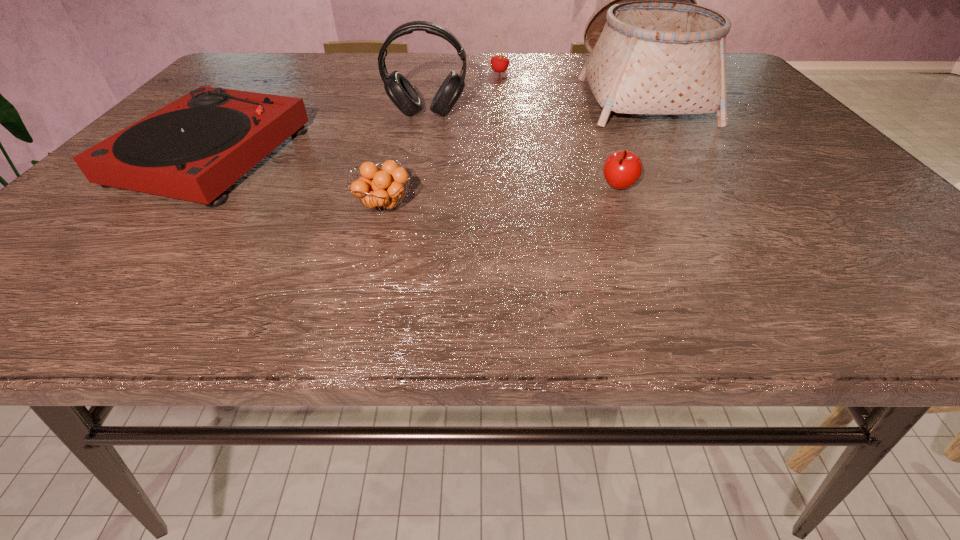
The image size is (960, 540). What are the coordinates of `vacant space located on the earcups of the fifth shortest object` in the screenshot? It's located at (408, 214).

Locate an element on the screen. vacant space positioned 0.260m on the right of the farther cherry is located at coordinates (600, 72).

Find the location of `vacant region located on the front of the record player`. vacant region located on the front of the record player is located at coordinates (125, 261).

The height and width of the screenshot is (540, 960). In order to click on vacant area situated on the back of the right cherry in this screenshot , I will do click(x=596, y=131).

Locate an element on the screen. vacant position located 0.340m on the back of the orange fruit is located at coordinates (409, 110).

The width and height of the screenshot is (960, 540). What are the coordinates of `basket at the far edge` in the screenshot? It's located at (653, 50).

The height and width of the screenshot is (540, 960). I want to click on cherry present at the far edge, so click(499, 63).

Image resolution: width=960 pixels, height=540 pixels. I want to click on object present at the left edge, so click(195, 148).

What are the coordinates of `object located in the right edge section of the desktop` in the screenshot? It's located at (653, 50).

Image resolution: width=960 pixels, height=540 pixels. I want to click on object positioned at the far right corner, so click(653, 50).